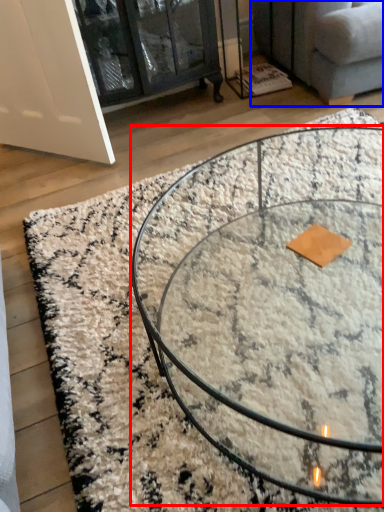
Question: Which object appears closest to the camera in this image, coffee table (highlighted by a red box) or studio couch (highlighted by a blue box)?

Choices:
 (A) coffee table
 (B) studio couch

Answer: (A)